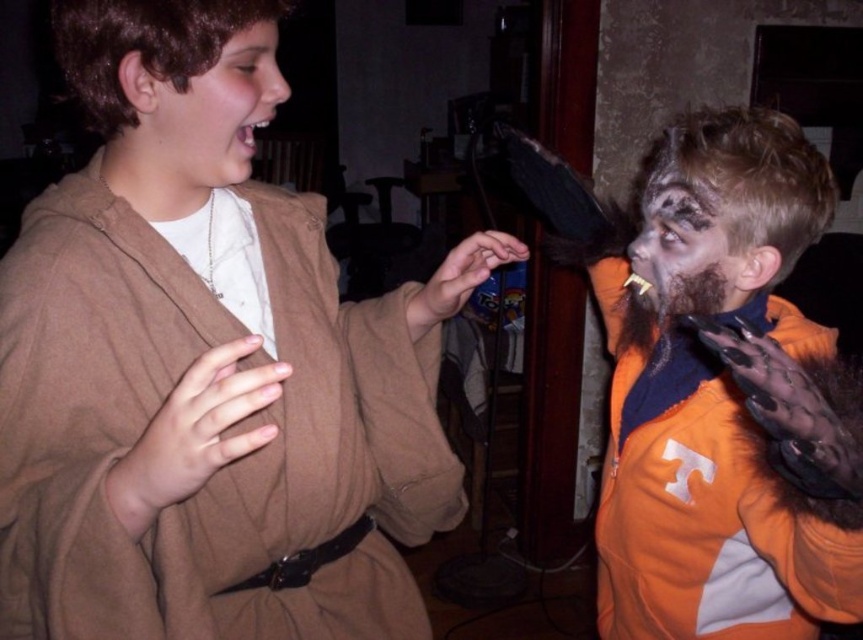
Who is more distant from viewer, (131, 72) or (616, 333)?

Positioned behind is point (616, 333).

Can you confirm if brown matte hair at upper left is positioned below brown fuzzy beard at right?

Incorrect, brown matte hair at upper left is not positioned below brown fuzzy beard at right.

At what (x,y) coordinates should I click in order to perform the action: click on brown matte hair at upper left. Please return your answer as a coordinate pair (x, y). Looking at the image, I should click on (209, 113).

Locate an element on the screen. The height and width of the screenshot is (640, 863). orange fuzzy jacket at right is located at coordinates (722, 394).

Is orange fuzzy jacket at right above gray matte face at right?

No, orange fuzzy jacket at right is not above gray matte face at right.

Does point (646, 561) lie behind point (688, 276)?

Yes, it is.

Locate an element on the screen. The width and height of the screenshot is (863, 640). orange fuzzy jacket at right is located at coordinates (722, 394).

This screenshot has height=640, width=863. Describe the element at coordinates (206, 365) in the screenshot. I see `brown matte robe at upper left` at that location.

Is brown matte robe at upper left shorter than brown fuzzy beard at right?

No, brown matte robe at upper left is not shorter than brown fuzzy beard at right.

Measure the distance between brown matte robe at upper left and camera.

brown matte robe at upper left and camera are 48.33 centimeters apart from each other.

In order to click on brown matte robe at upper left in this screenshot , I will do `click(206, 365)`.